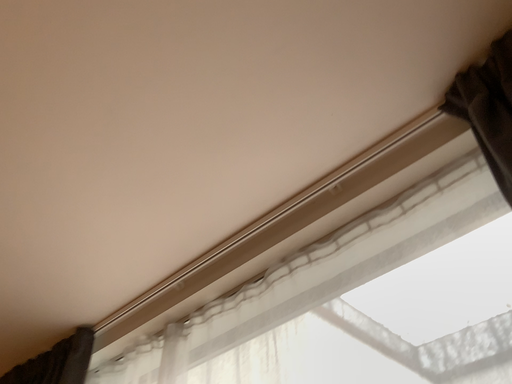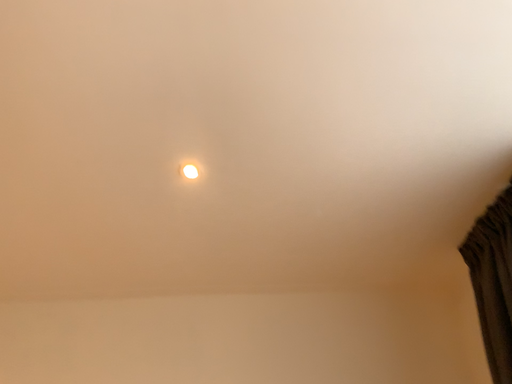
Question: Which way did the camera rotate in the video?

Choices:
 (A) rotated upward
 (B) rotated downward

Answer: (B)